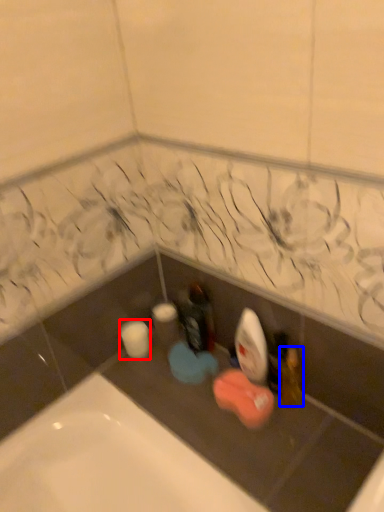
Question: Which point is closer to the camera, toilet paper (highlighted by a red box) or toiletry (highlighted by a blue box)?

Choices:
 (A) toilet paper
 (B) toiletry

Answer: (B)